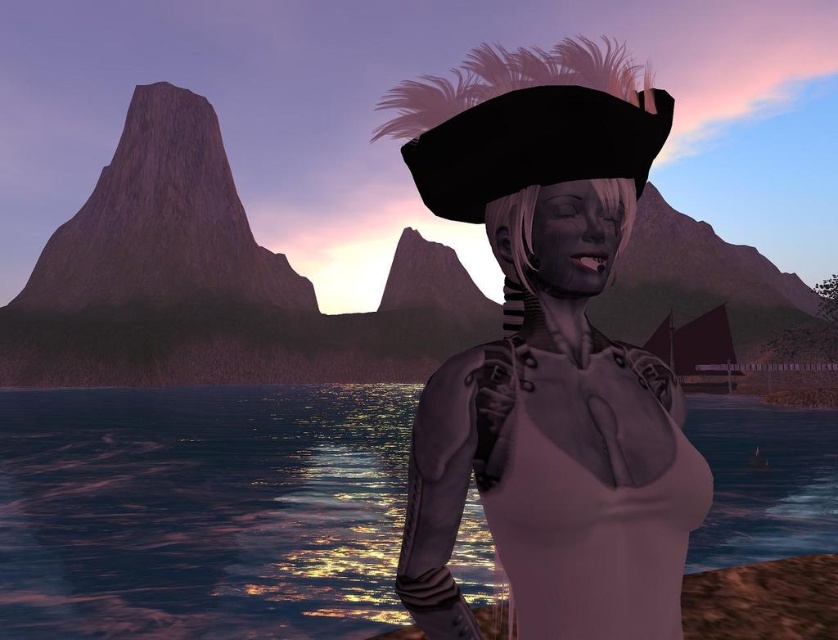
Can you confirm if glistening water at center is positioned to the right of satin pink dress at center?

Correct, you'll find glistening water at center to the right of satin pink dress at center.

Who is higher up, glistening water at center or satin pink dress at center?

Positioned higher is satin pink dress at center.

Image resolution: width=838 pixels, height=640 pixels. Find the location of `glistening water at center`. glistening water at center is located at coordinates (200, 512).

Where is `glistening water at center`? Image resolution: width=838 pixels, height=640 pixels. glistening water at center is located at coordinates (200, 512).

Which is in front, point (272, 634) or point (432, 616)?

Point (432, 616) is in front.

This screenshot has height=640, width=838. Find the location of `glistening water at center`. glistening water at center is located at coordinates (200, 512).

Who is positioned more to the left, matte black pirate hat at center or satin pink dress at center?

matte black pirate hat at center

The height and width of the screenshot is (640, 838). Describe the element at coordinates (549, 360) in the screenshot. I see `matte black pirate hat at center` at that location.

At what (x,y) coordinates should I click in order to perform the action: click on matte black pirate hat at center. Please return your answer as a coordinate pair (x, y). Looking at the image, I should click on (549, 360).